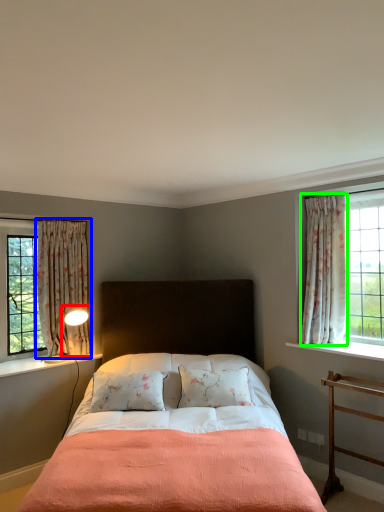
Question: Estimate the real-world distances between objects in this image. Which object is closer to table lamp (highlighted by a red box), curtain (highlighted by a blue box) or curtain (highlighted by a green box)?

Choices:
 (A) curtain
 (B) curtain

Answer: (A)